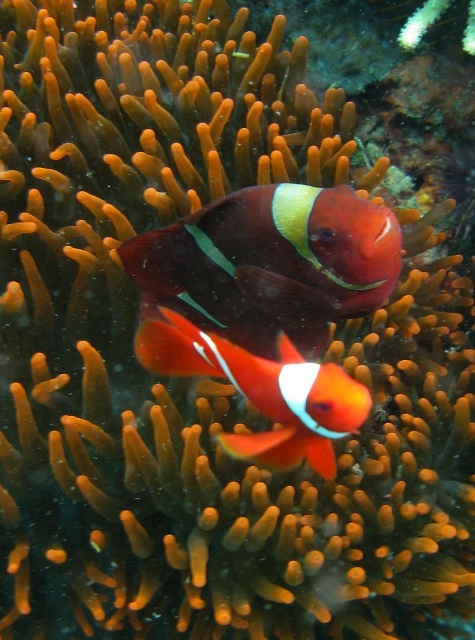
Based on the photo, which of these two, shiny red clownfish at center or orange matte clownfish at center, stands taller?

With more height is shiny red clownfish at center.

Based on the photo, who is more distant from viewer, (295,205) or (351,419)?

Point (295,205)

Image resolution: width=475 pixels, height=640 pixels. What are the coordinates of `shiny red clownfish at center` in the screenshot? It's located at (269, 262).

Locate an element on the screen. shiny red clownfish at center is located at coordinates (269, 262).